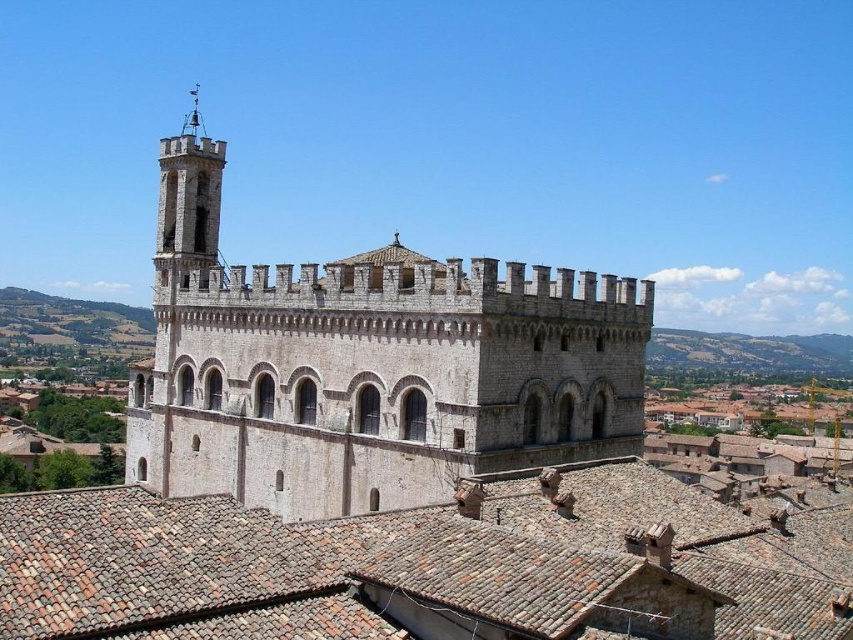
You are standing in a historic European town and see the white stone church at center and the brown tile roof at center. Which structure is higher?

The white stone church at center is much taller than the brown tile roof at center.

You are an architect planning to install a new streetlight between the white stone church at center and the brown tile roof at center. The streetlight requires a minimum of 15 meters of space between the two structures to be installed safely. Based on the scene, can the streetlight be placed there?

The white stone church at center and brown tile roof at center are 20.20 meters apart from each other. Since the required space is 15 meters, the streetlight can be safely installed between them as the distance is sufficient.

You are a tourist standing in front of the historic stone building. You notice the white stone church at center and the brown tile roof at center. Which of these two objects is closer to you?

The white stone church at center is closer to you because the brown tile roof at center is behind it.